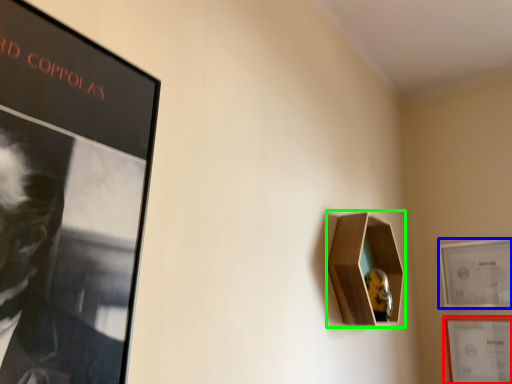
Question: Which object is positioned closest to picture frame (highlighted by a red box)? Select from picture frame (highlighted by a blue box) and cabinet (highlighted by a green box).

Choices:
 (A) picture frame
 (B) cabinet

Answer: (A)